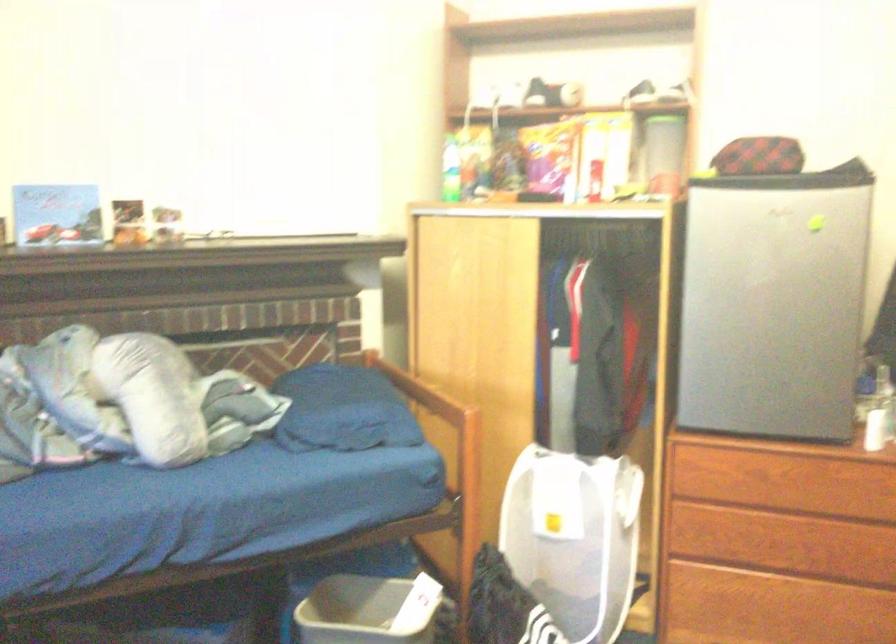
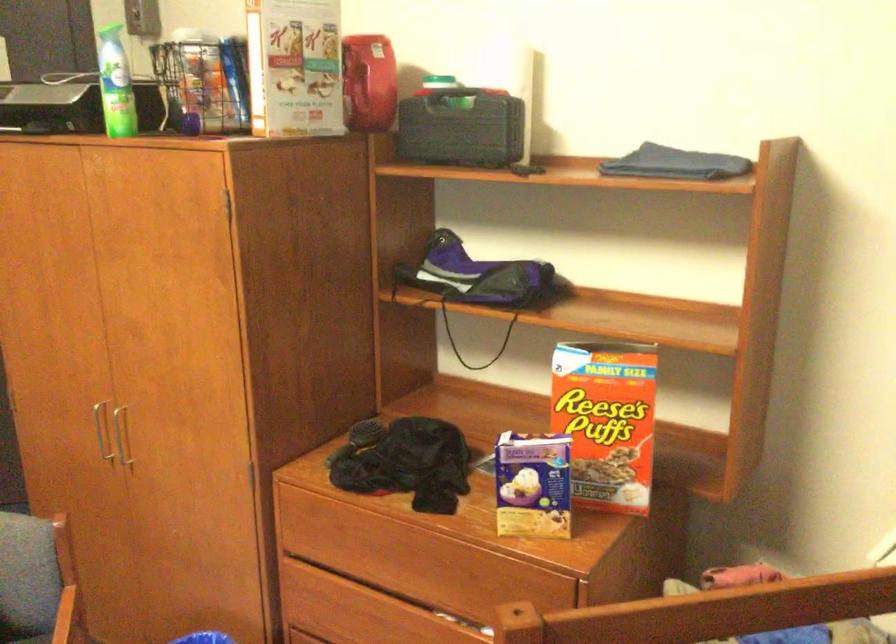
Question: Based on the continuous images, in which direction is the camera rotating? Reply with the corresponding letter.

Choices:
 (A) Left
 (B) Right
 (C) Up
 (D) Down

Answer: (B)